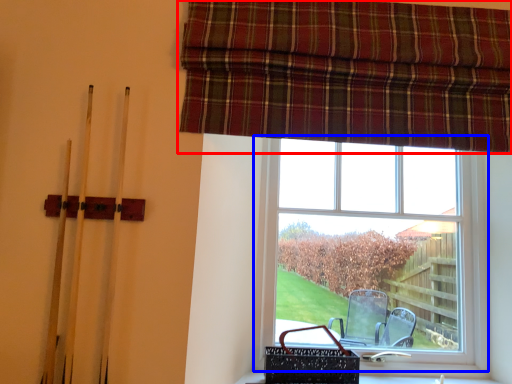
Question: Which object is closer to the camera taking this photo, curtain (highlighted by a red box) or window (highlighted by a blue box)?

Choices:
 (A) curtain
 (B) window

Answer: (A)